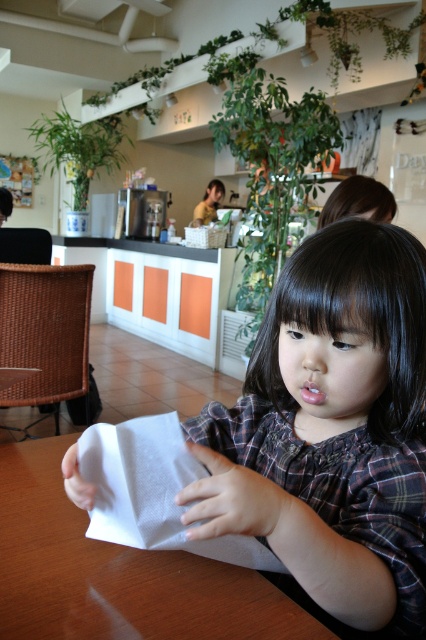
You are a barista at the counter and need to place a cup of coffee between the white paper napkin at center and the white paper at center. Can you fit the cup in the space between them?

The distance between the white paper napkin at center and the white paper at center is 7.08 inches, which is sufficient to place a standard coffee cup between them as most cups are smaller than this space.

You are standing in the cafe and want to take a photo of both the child at the point with coordinates (325, 308) and the counter worker at the point with coordinates (296, 612). Which point should you focus on first to ensure both are in focus?

You should focus on point (325, 308) first because it is closer to the camera than point (296, 612). This way, both points will be in focus as the child is nearer and the counter worker is further away.